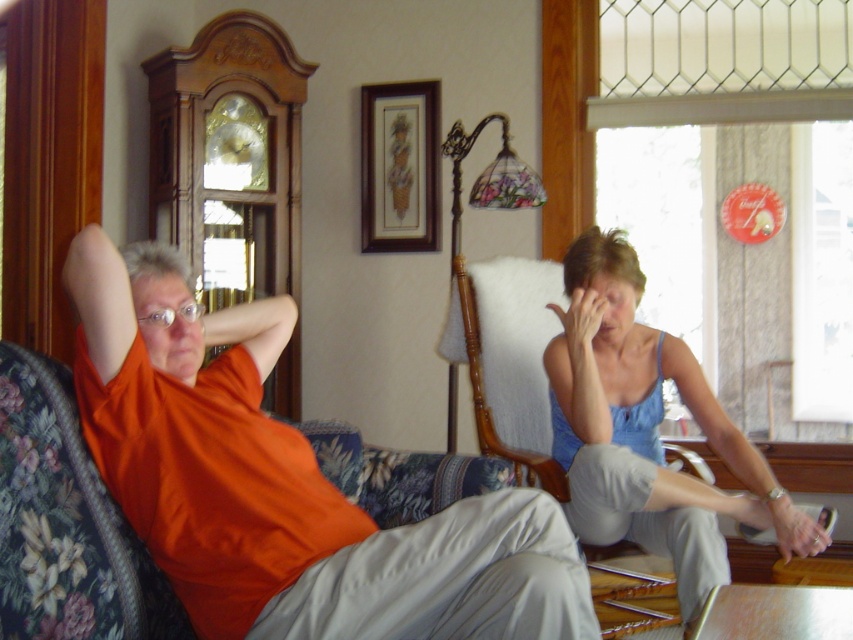
Who is positioned more to the left, blue fabric tank top at lower right or wooden picture frame at upper center?

A: From the viewer's perspective, wooden picture frame at upper center appears more on the left side.

Image resolution: width=853 pixels, height=640 pixels. What do you see at coordinates (647, 429) in the screenshot?
I see `blue fabric tank top at lower right` at bounding box center [647, 429].

Is point (643, 394) positioned before point (393, 132)?

Yes, it is.

Locate an element on the screen. blue fabric tank top at lower right is located at coordinates (647, 429).

Does blue fabric tank top at lower right appear on the right side of light blue fabric armchair at center?

Correct, you'll find blue fabric tank top at lower right to the right of light blue fabric armchair at center.

In the scene shown: Is blue fabric tank top at lower right smaller than light blue fabric armchair at center?

No, blue fabric tank top at lower right is not smaller than light blue fabric armchair at center.

Locate an element on the screen. Image resolution: width=853 pixels, height=640 pixels. blue fabric tank top at lower right is located at coordinates (647, 429).

Is the position of light blue fabric armchair at center more distant than that of wooden picture frame at upper center?

That is False.

Who is lower down, light blue fabric armchair at center or wooden picture frame at upper center?

Positioned lower is light blue fabric armchair at center.

Is point (612, 602) farther from camera compared to point (438, 132)?

No, (612, 602) is in front of (438, 132).

You are a GUI agent. You are given a task and a screenshot of the screen. Output one action in this format:
    pyautogui.click(x=<x>, y=<y>)
    Task: Click on the light blue fabric armchair at center
    This screenshot has width=853, height=640.
    Given the screenshot: What is the action you would take?
    pyautogui.click(x=508, y=356)